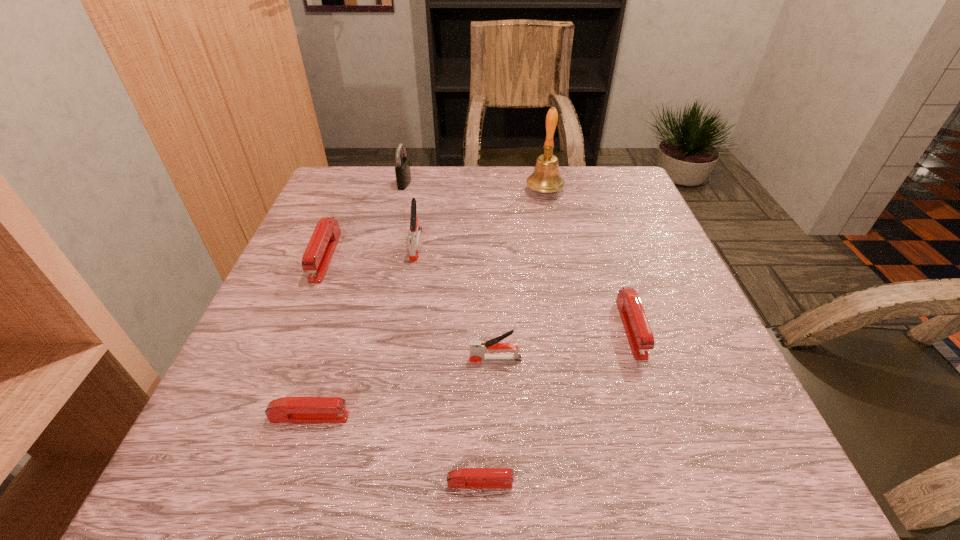
Locate an element on the screen. The image size is (960, 540). empty location between the fourth object from left to right and the rightmost object is located at coordinates (523, 286).

Find the location of `free point between the fifth object from right to left and the second stapler from left to right`. free point between the fifth object from right to left and the second stapler from left to right is located at coordinates (363, 331).

Locate an element on the screen. This screenshot has height=540, width=960. free spot between the farthest red stapler and the rightmost red stapler is located at coordinates (478, 292).

At what (x,y) coordinates should I click in order to perform the action: click on free space between the padlock and the second red stapler from left to right. Please return your answer as a coordinate pair (x, y). The width and height of the screenshot is (960, 540). Looking at the image, I should click on (357, 300).

At what (x,y) coordinates should I click in order to perform the action: click on free space between the rightmost object and the leftmost object. Please return your answer as a coordinate pair (x, y). The height and width of the screenshot is (540, 960). Looking at the image, I should click on (478, 292).

Identify the location of empty location between the nearest stapler and the second object from right to left. (513, 337).

Identify which object is the second closest to the second red stapler from left to right. Please provide its 2D coordinates. Your answer should be formatted as a tuple, i.e. [(x, y)], where the tuple contains the x and y coordinates of a point satisfying the conditions above.

[(478, 348)]

Locate an element on the screen. Image resolution: width=960 pixels, height=540 pixels. object that is the third nearest to the black padlock is located at coordinates (546, 178).

The image size is (960, 540). In order to click on stapler identified as the fourth closest to the third shortest stapler in this screenshot , I will do `click(286, 409)`.

At what (x,y) coordinates should I click in order to perform the action: click on the second closest stapler to the third farthest red stapler. Please return your answer as a coordinate pair (x, y). This screenshot has width=960, height=540. Looking at the image, I should click on (478, 348).